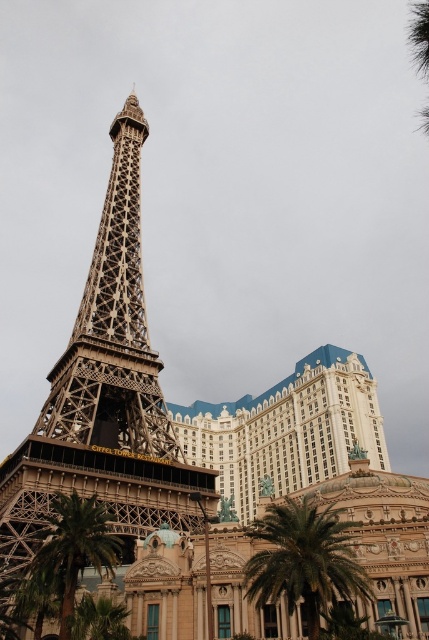
How distant is metallic gold tower at center from green leafy palm tree at center?

metallic gold tower at center and green leafy palm tree at center are 17.83 meters apart from each other.

Based on the photo, between metallic gold tower at center and green leafy palm tree at center, which one appears on the left side from the viewer's perspective?

Positioned to the left is metallic gold tower at center.

This screenshot has height=640, width=429. In order to click on metallic gold tower at center in this screenshot , I will do `click(105, 394)`.

Is green leafy palm tree at center shorter than green leafy palm tree at lower left?

No.

Consider the image. Who is more distant from viewer, [259,564] or [72,586]?

Point [259,564]

Describe the element at coordinates (304, 561) in the screenshot. I see `green leafy palm tree at center` at that location.

The height and width of the screenshot is (640, 429). In order to click on green leafy palm tree at center in this screenshot , I will do pyautogui.click(x=304, y=561).

Is point (142, 420) closer to camera compared to point (84, 499)?

No.

This screenshot has height=640, width=429. Describe the element at coordinates (105, 394) in the screenshot. I see `metallic gold tower at center` at that location.

Locate an element on the screen. The height and width of the screenshot is (640, 429). metallic gold tower at center is located at coordinates (105, 394).